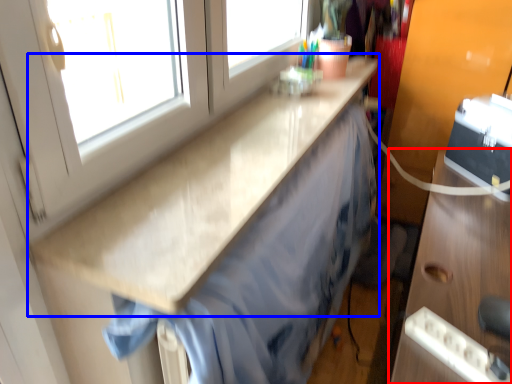
Question: Which object is further to the camera taking this photo, cabinetry (highlighted by a red box) or countertop (highlighted by a blue box)?

Choices:
 (A) cabinetry
 (B) countertop

Answer: (B)